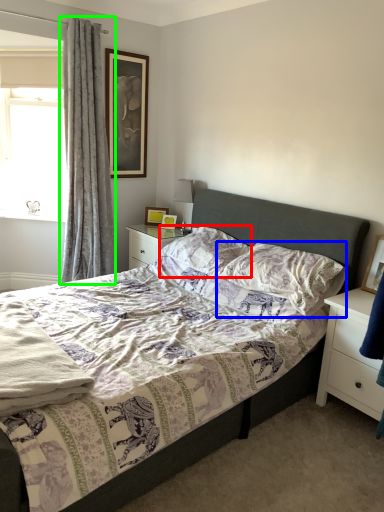
Question: Which object is positioned closest to pillow (highlighted by a red box)? Select from pillow (highlighted by a blue box) and curtain (highlighted by a green box).

Choices:
 (A) pillow
 (B) curtain

Answer: (A)